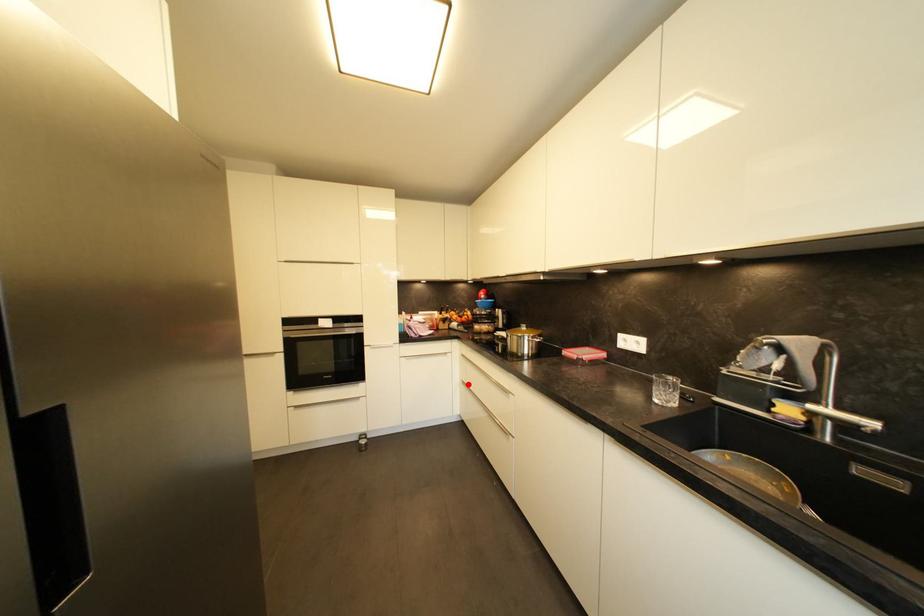
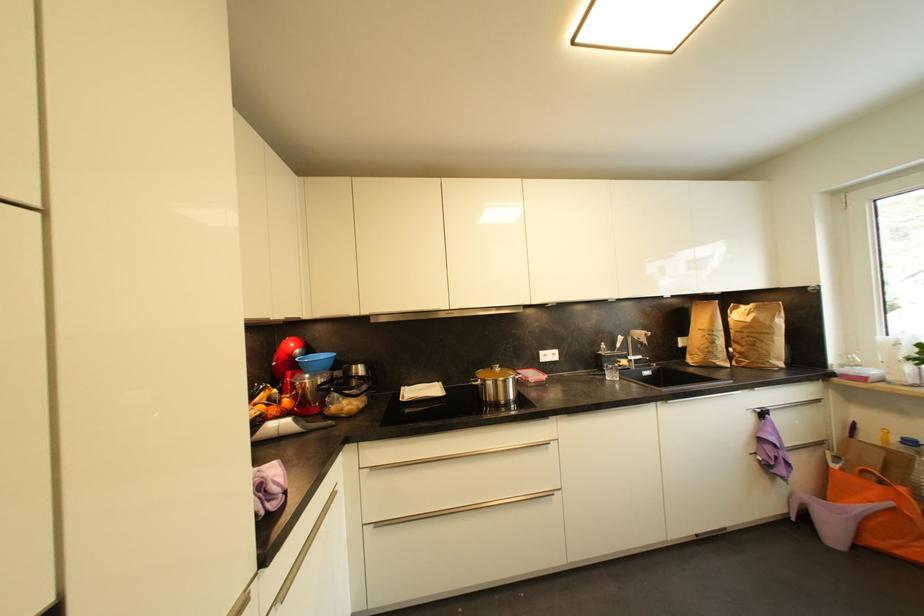
In the second image, find the point that corresponds to the highlighted location in the first image.

(382, 527)